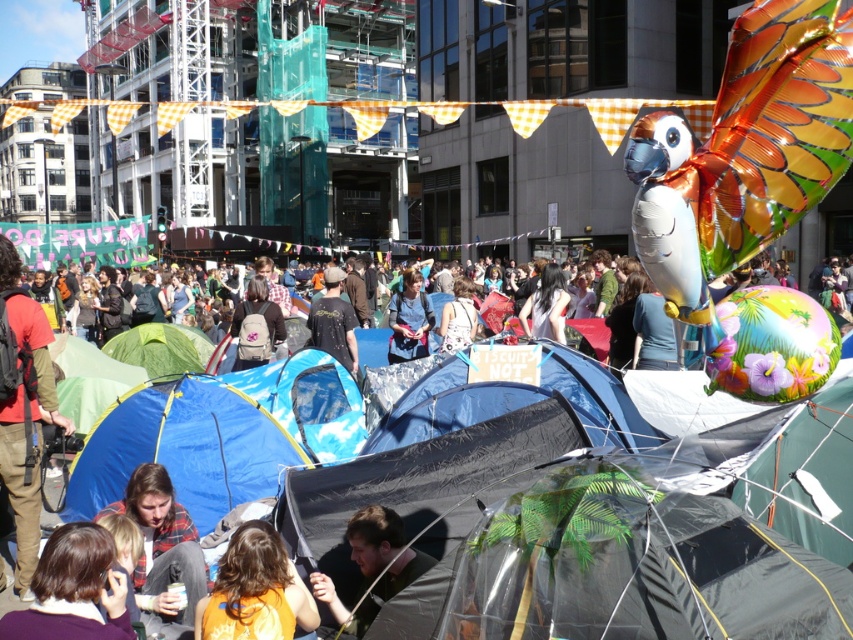
Does red shirt at lower left appear on the right side of black t-shirt at center?

Incorrect, red shirt at lower left is not on the right side of black t-shirt at center.

Is red shirt at lower left to the left of black t-shirt at center from the viewer's perspective?

Yes, red shirt at lower left is to the left of black t-shirt at center.

Between point (4, 472) and point (326, 317), which one is positioned in front?

Point (4, 472)

You are a GUI agent. You are given a task and a screenshot of the screen. Output one action in this format:
    pyautogui.click(x=<x>, y=<y>)
    Task: Click on the red shirt at lower left
    
    Given the screenshot: What is the action you would take?
    pyautogui.click(x=19, y=488)

Consider the image. Which of these two, blue tarpaulin tent at center or blue fabric shirt at center, stands shorter?

blue tarpaulin tent at center

Between blue tarpaulin tent at center and blue fabric shirt at center, which one has more height?

Standing taller between the two is blue fabric shirt at center.

Does point (492, 384) come farther from viewer compared to point (412, 298)?

No, it is not.

Find the location of a particular element. Image resolution: width=853 pixels, height=640 pixels. blue tarpaulin tent at center is located at coordinates (514, 403).

Consider the image. Can you confirm if dark brown hair at lower left is positioned below blue fabric shirt at center?

Indeed, dark brown hair at lower left is positioned under blue fabric shirt at center.

From the picture: Which of these two, dark brown hair at lower left or blue fabric shirt at center, stands shorter?

Standing shorter between the two is dark brown hair at lower left.

Who is more distant from viewer, (96, 564) or (410, 300)?

The point (410, 300) is behind.

Locate an element on the screen. The width and height of the screenshot is (853, 640). dark brown hair at lower left is located at coordinates (73, 589).